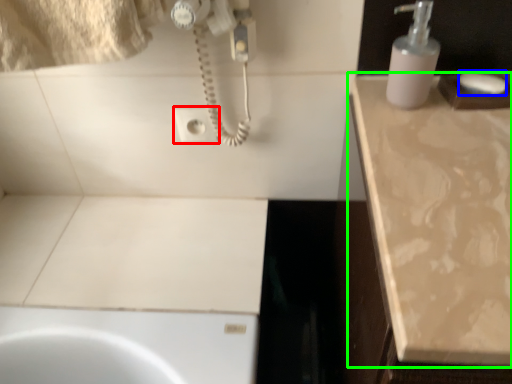
Question: Which is farther away from electric outlet (highlighted by a red box)? soap (highlighted by a blue box) or countertop (highlighted by a green box)?

Choices:
 (A) soap
 (B) countertop

Answer: (A)